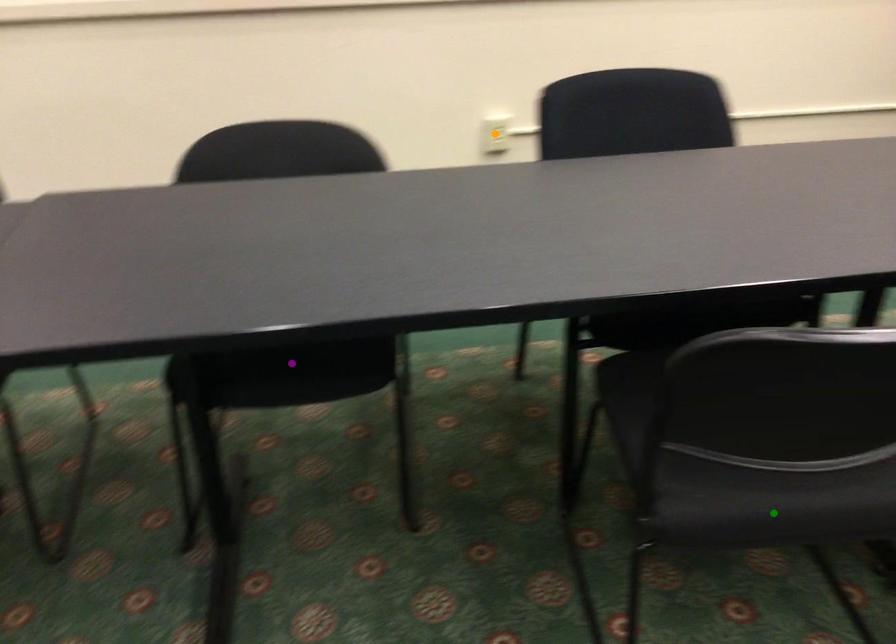
Order these from nearest to farthest:
- green point
- orange point
- purple point

orange point, purple point, green point